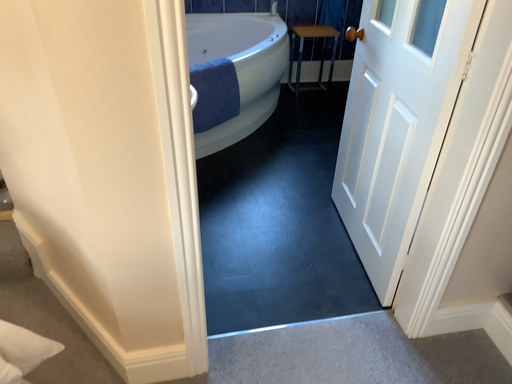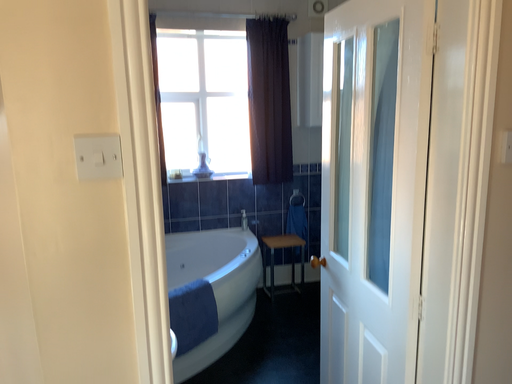
Question: How did the camera likely rotate when shooting the video?

Choices:
 (A) rotated upward
 (B) rotated downward

Answer: (A)